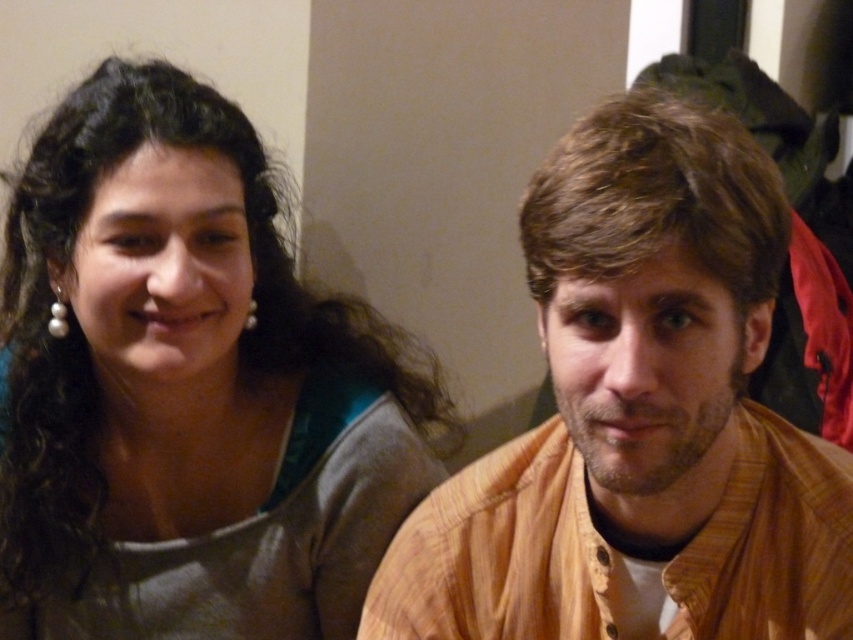
Is matte green dress at left wider than pearl earring at left?

Indeed, matte green dress at left has a greater width compared to pearl earring at left.

Which is behind, point (109, 284) or point (57, 336)?

Positioned behind is point (57, 336).

Is point (151, 342) closer to viewer compared to point (62, 323)?

Yes.

Locate an element on the screen. The image size is (853, 640). matte green dress at left is located at coordinates (186, 388).

Can you confirm if matte green dress at left is thinner than brown striped shirt at right?

In fact, matte green dress at left might be wider than brown striped shirt at right.

Between matte green dress at left and brown striped shirt at right, which one is positioned higher?

matte green dress at left

The image size is (853, 640). What are the coordinates of `matte green dress at left` in the screenshot? It's located at (186, 388).

The width and height of the screenshot is (853, 640). In order to click on matte green dress at left in this screenshot , I will do `click(186, 388)`.

Does pearl earring at left have a lesser width compared to pearlearring at upper left?

Incorrect, pearl earring at left's width is not less than pearlearring at upper left's.

Is pearl earring at left positioned at the back of pearlearring at upper left?

No, it is in front of pearlearring at upper left.

Between point (54, 307) and point (251, 326), which one is positioned behind?

Positioned behind is point (251, 326).

The width and height of the screenshot is (853, 640). I want to click on pearl earring at left, so click(57, 316).